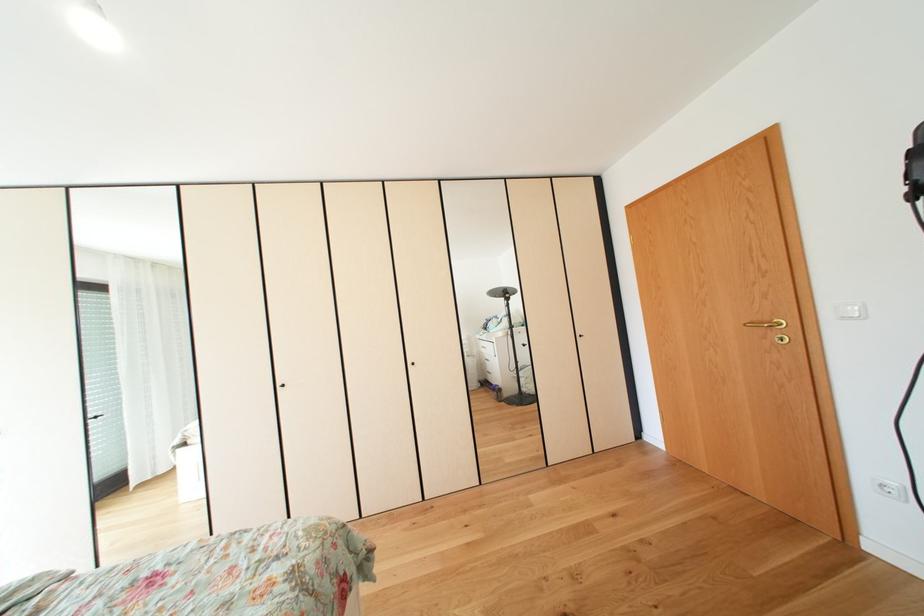
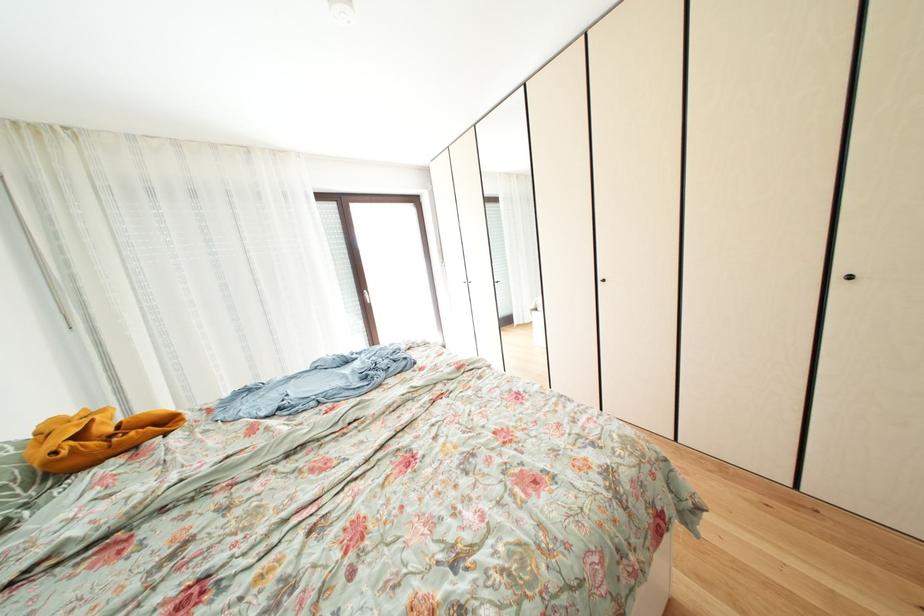
The first image is from the beginning of the video and the second image is from the end. How did the camera likely rotate when shooting the video?

The camera rotated toward left-down.